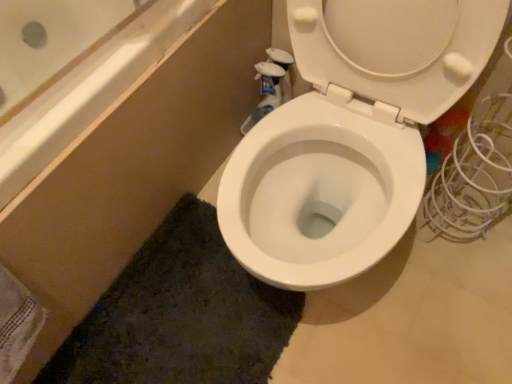
Question: Does white textured towel at lower left appear on the left side of white glossy toilet at center?

Choices:
 (A) yes
 (B) no

Answer: (A)

Question: Can you confirm if white textured towel at lower left is smaller than white glossy toilet at center?

Choices:
 (A) yes
 (B) no

Answer: (A)

Question: Does white textured towel at lower left turn towards white glossy toilet at center?

Choices:
 (A) no
 (B) yes

Answer: (A)

Question: From a real-world perspective, is white textured towel at lower left below white glossy toilet at center?

Choices:
 (A) yes
 (B) no

Answer: (A)

Question: Is white textured towel at lower left positioned behind white glossy toilet at center?

Choices:
 (A) no
 (B) yes

Answer: (B)

Question: Is white textured towel at lower left turned away from white glossy toilet at center?

Choices:
 (A) no
 (B) yes

Answer: (A)

Question: Is white glossy toilet at center located within dark green textured bath mat at lower center?

Choices:
 (A) no
 (B) yes

Answer: (A)

Question: Can you confirm if dark green textured bath mat at lower center is positioned to the right of white glossy toilet at center?

Choices:
 (A) no
 (B) yes

Answer: (A)

Question: From a real-world perspective, is dark green textured bath mat at lower center physically above white glossy toilet at center?

Choices:
 (A) no
 (B) yes

Answer: (A)

Question: Considering the relative positions of dark green textured bath mat at lower center and white glossy toilet at center in the image provided, is dark green textured bath mat at lower center behind white glossy toilet at center?

Choices:
 (A) no
 (B) yes

Answer: (B)

Question: Is dark green textured bath mat at lower center far away from white glossy toilet at center?

Choices:
 (A) no
 (B) yes

Answer: (A)

Question: Is dark green textured bath mat at lower center smaller than white glossy toilet at center?

Choices:
 (A) yes
 (B) no

Answer: (A)

Question: From a real-world perspective, is white glossy toilet at center physically below dark green textured bath mat at lower center?

Choices:
 (A) yes
 (B) no

Answer: (B)